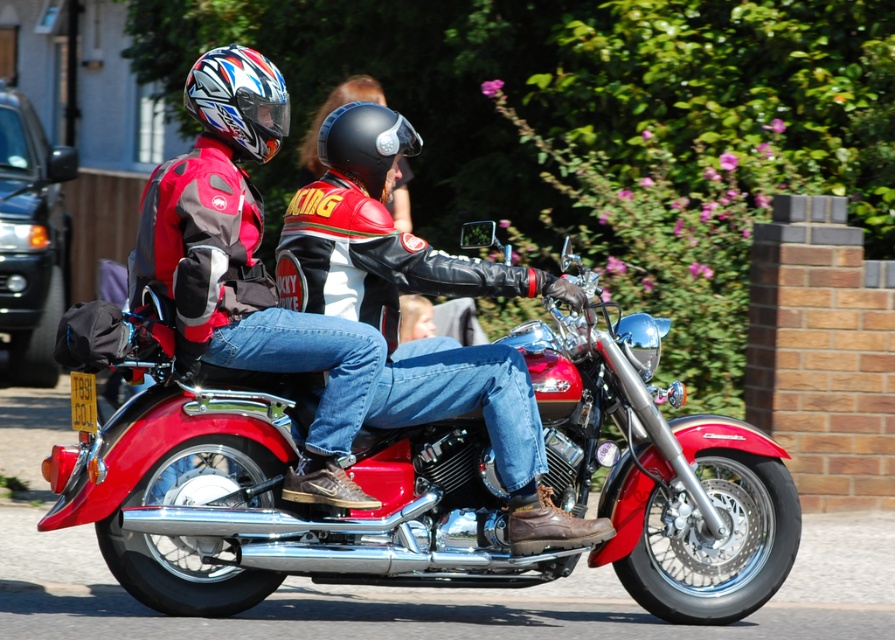
Is point (260, 77) in front of point (394, 122)?

Yes, it is.

This screenshot has height=640, width=895. What do you see at coordinates (239, 100) in the screenshot? I see `shiny multicolored helmet at upper left` at bounding box center [239, 100].

Identify the location of shiny multicolored helmet at upper left. pyautogui.click(x=239, y=100).

Does matte black helmet at upper left have a smaller size compared to shiny multicolored helmet at upper left?

No.

Which is in front, point (346, 362) or point (258, 136)?

Positioned in front is point (346, 362).

This screenshot has width=895, height=640. What are the coordinates of `matte black helmet at upper left` in the screenshot? It's located at (246, 268).

Is matte black helmet at upper left thinner than black matte helmet at center?

Incorrect, matte black helmet at upper left's width is not less than black matte helmet at center's.

Between matte black helmet at upper left and black matte helmet at center, which one appears on the left side from the viewer's perspective?

Positioned to the left is matte black helmet at upper left.

Who is more distant from viewer, (x=263, y=348) or (x=379, y=125)?

Positioned behind is point (x=379, y=125).

Image resolution: width=895 pixels, height=640 pixels. In order to click on matte black helmet at upper left in this screenshot , I will do `click(246, 268)`.